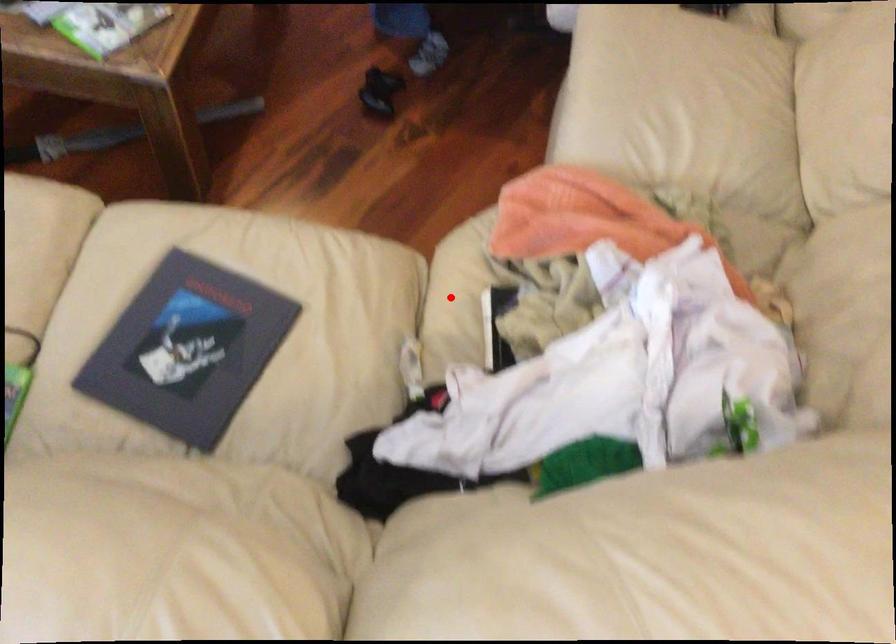
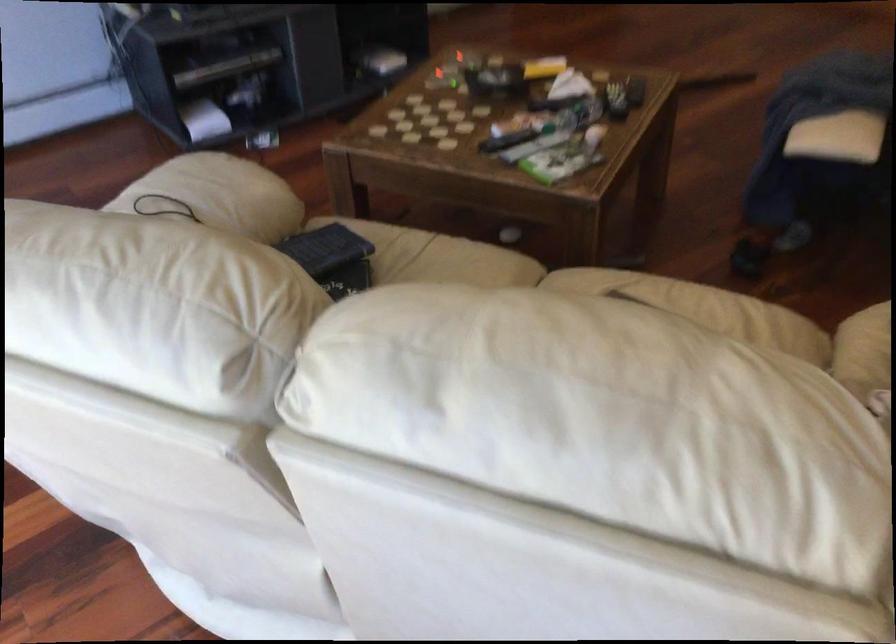
In the second image, find the point that corresponds to the highlighted location in the first image.

(864, 351)